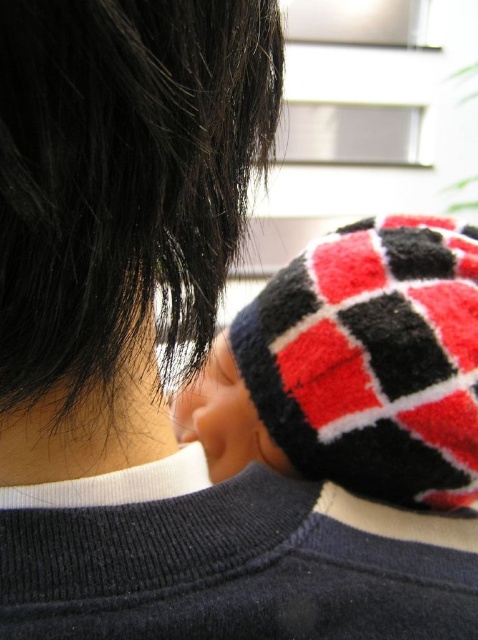
Question: Is shiny dark hair at upper left in front of knitted wool hat at upper right?

Choices:
 (A) no
 (B) yes

Answer: (B)

Question: Which point appears closest to the camera in this image?

Choices:
 (A) (382, 285)
 (B) (268, 116)

Answer: (B)

Question: From the image, what is the correct spatial relationship of shiny dark hair at upper left in relation to knitted wool hat at upper right?

Choices:
 (A) right
 (B) left

Answer: (B)

Question: Is shiny dark hair at upper left smaller than knitted wool hat at upper right?

Choices:
 (A) yes
 (B) no

Answer: (A)

Question: Which object is farther from the camera taking this photo?

Choices:
 (A) knitted wool hat at upper right
 (B) shiny dark hair at upper left

Answer: (A)